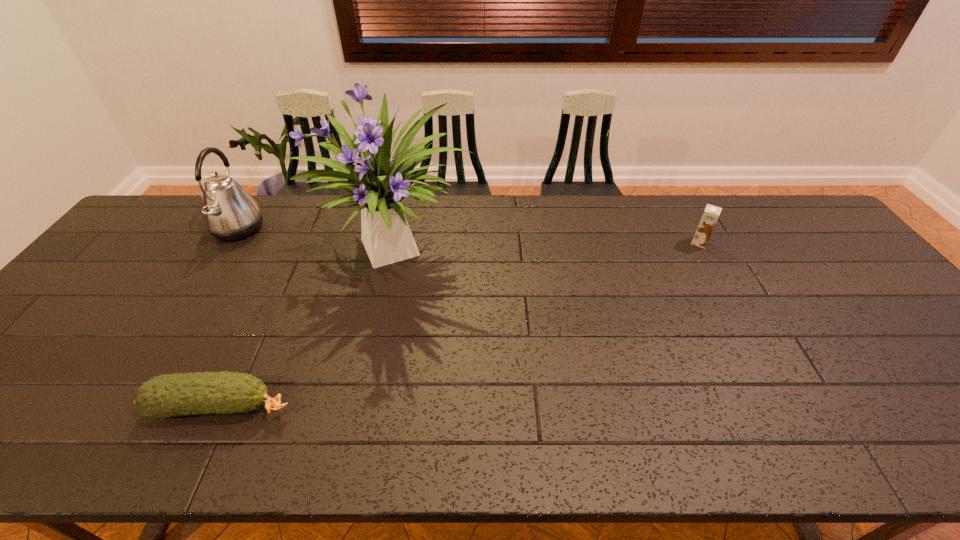
Where is `vacant position in the image that satisfies the following two spatial constraints: 1. on the back side of the chocolate milk; 2. from the spout of the kettle`? vacant position in the image that satisfies the following two spatial constraints: 1. on the back side of the chocolate milk; 2. from the spout of the kettle is located at coordinates (691, 229).

In order to click on free space that satisfies the following two spatial constraints: 1. from the spout of the second tallest object; 2. on the back side of the flower arrangement in this screenshot , I will do tap(224, 251).

Where is `free location that satisfies the following two spatial constraints: 1. from the spout of the tallest object; 2. on the left side of the kettle`? This screenshot has width=960, height=540. free location that satisfies the following two spatial constraints: 1. from the spout of the tallest object; 2. on the left side of the kettle is located at coordinates (224, 251).

Where is `free region that satisfies the following two spatial constraints: 1. from the spout of the flower arrangement; 2. on the left side of the third shortest object`? free region that satisfies the following two spatial constraints: 1. from the spout of the flower arrangement; 2. on the left side of the third shortest object is located at coordinates (224, 251).

Image resolution: width=960 pixels, height=540 pixels. What are the coordinates of `vacant space that satisfies the following two spatial constraints: 1. from the spout of the flower arrangement; 2. on the right side of the kettle` in the screenshot? It's located at (224, 251).